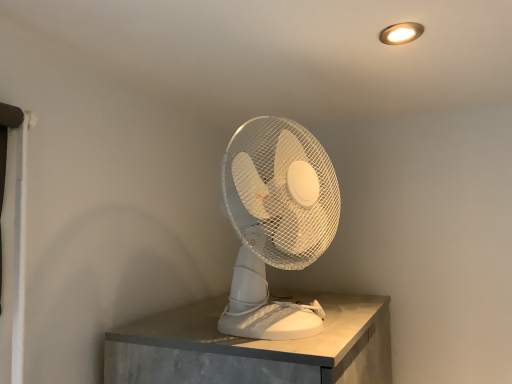
Image resolution: width=512 pixels, height=384 pixels. I want to click on vacant space positioned to the left of matte gold light fixture at upper right, so click(323, 33).